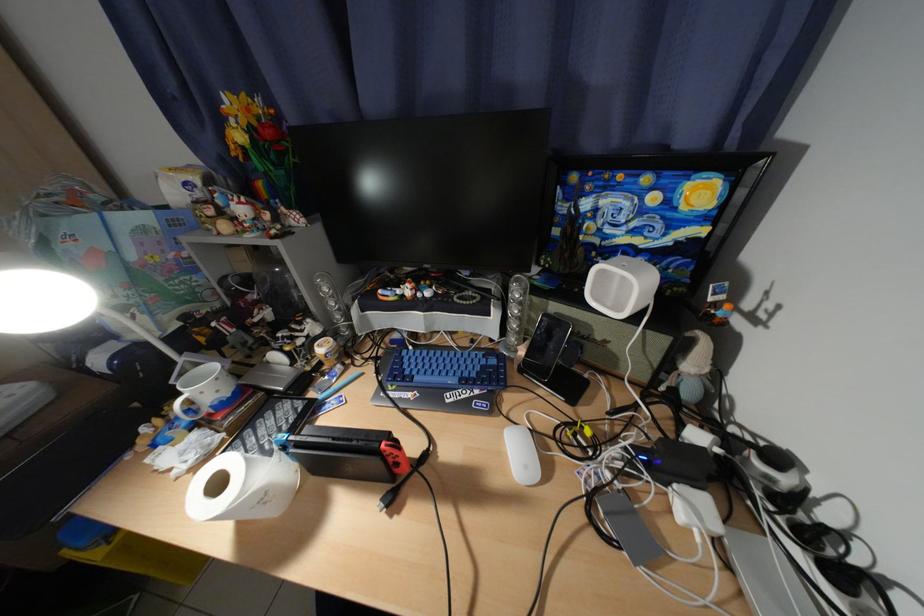
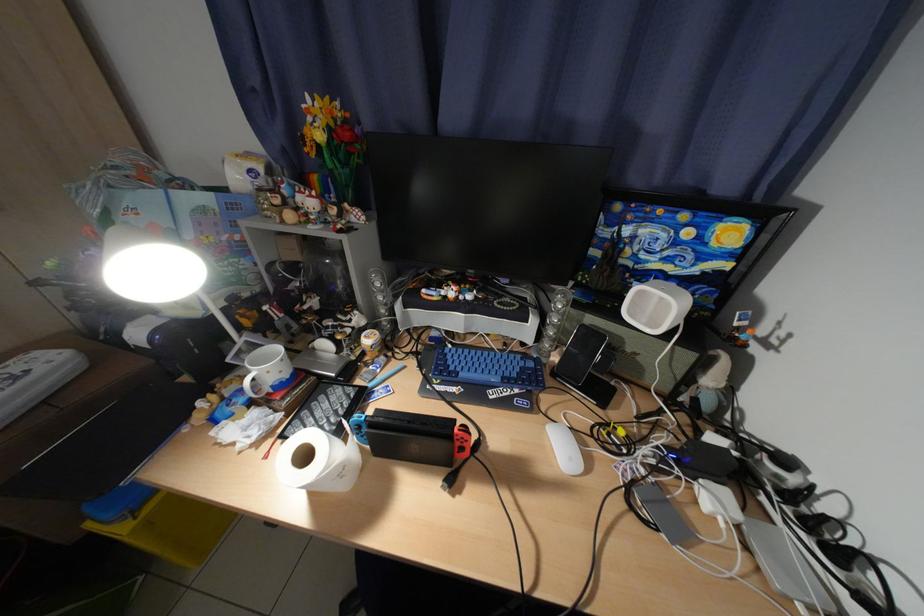
The point at (419, 373) is marked in the first image. Where is the corresponding point in the second image?

(464, 370)